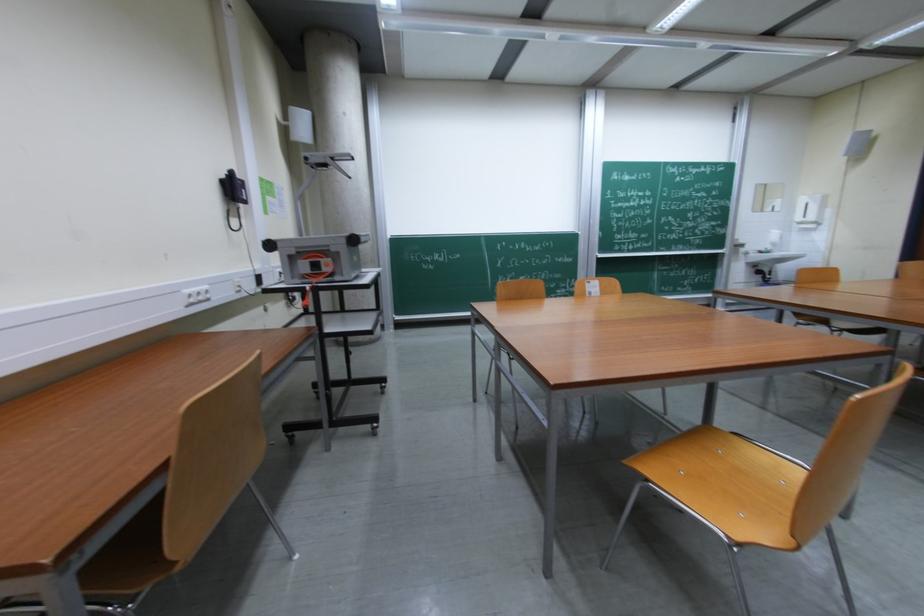
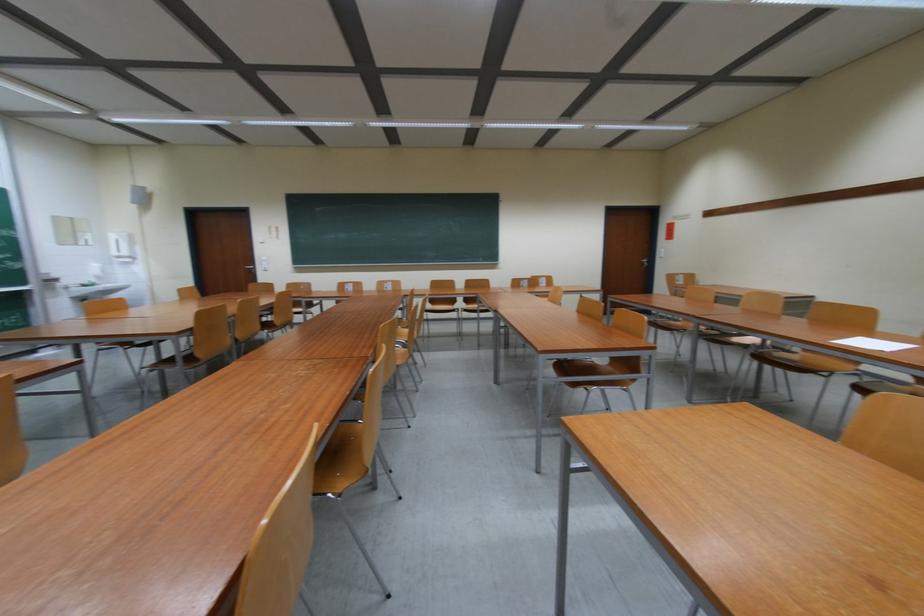
Question: How did the camera likely rotate?

Choices:
 (A) Left
 (B) Right
 (C) Up
 (D) Down

Answer: (B)